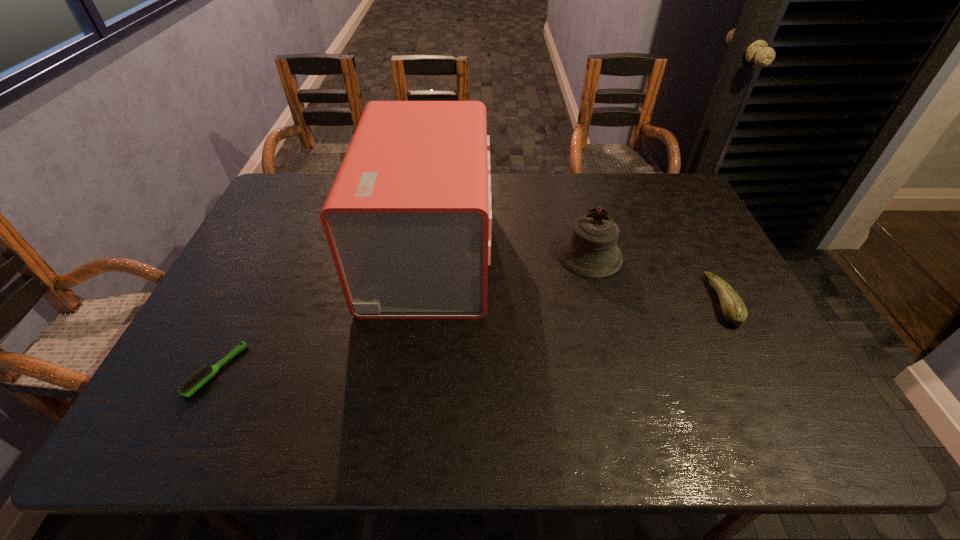
This screenshot has width=960, height=540. What are the coordinates of `vacant point located 0.190m at the stem end of the third tallest object` in the screenshot? It's located at (640, 301).

Where is `vacant region located at the stem end of the third tallest object`? The image size is (960, 540). vacant region located at the stem end of the third tallest object is located at coordinates (573, 301).

This screenshot has height=540, width=960. In order to click on vacant space located 0.400m at the stem end of the third tallest object in this screenshot , I will do `click(563, 301)`.

At what (x,y) coordinates should I click in order to perform the action: click on vacant space situated on the front of the hairbrush. Please return your answer as a coordinate pair (x, y). This screenshot has height=540, width=960. Looking at the image, I should click on (184, 435).

Image resolution: width=960 pixels, height=540 pixels. I want to click on object located at the far edge, so click(x=408, y=220).

You are a GUI agent. You are given a task and a screenshot of the screen. Output one action in this format:
    pyautogui.click(x=<x>, y=<y>)
    Task: Click on the object that is at the left edge
    
    Given the screenshot: What is the action you would take?
    pyautogui.click(x=194, y=382)

At what (x,y) coordinates should I click in order to perform the action: click on object at the right edge. Please return your answer as a coordinate pair (x, y). Looking at the image, I should click on (734, 310).

What are the coordinates of `blank space at the far edge of the desktop` in the screenshot? It's located at (621, 190).

Image resolution: width=960 pixels, height=540 pixels. What are the coordinates of `vacant region at the left edge of the desktop` in the screenshot? It's located at (255, 236).

Image resolution: width=960 pixels, height=540 pixels. In order to click on vacant area at the right edge in this screenshot , I will do `click(758, 336)`.